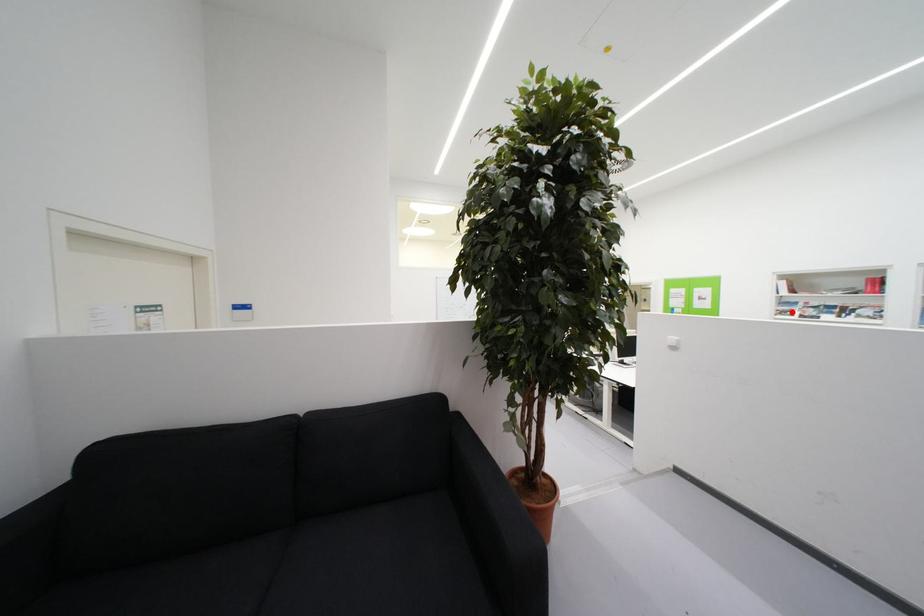
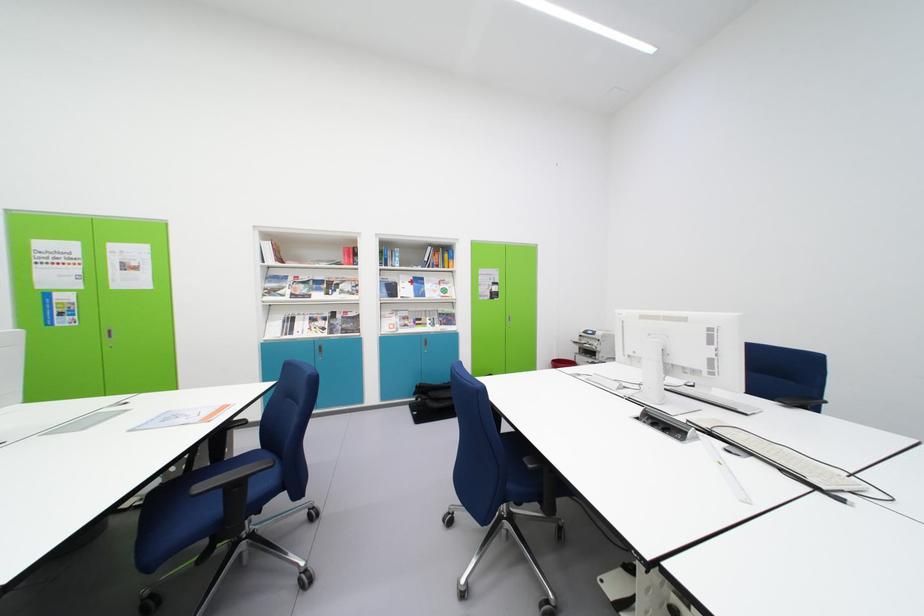
Locate, in the second image, the point that corresponds to the highlighted location in the first image.

(281, 289)